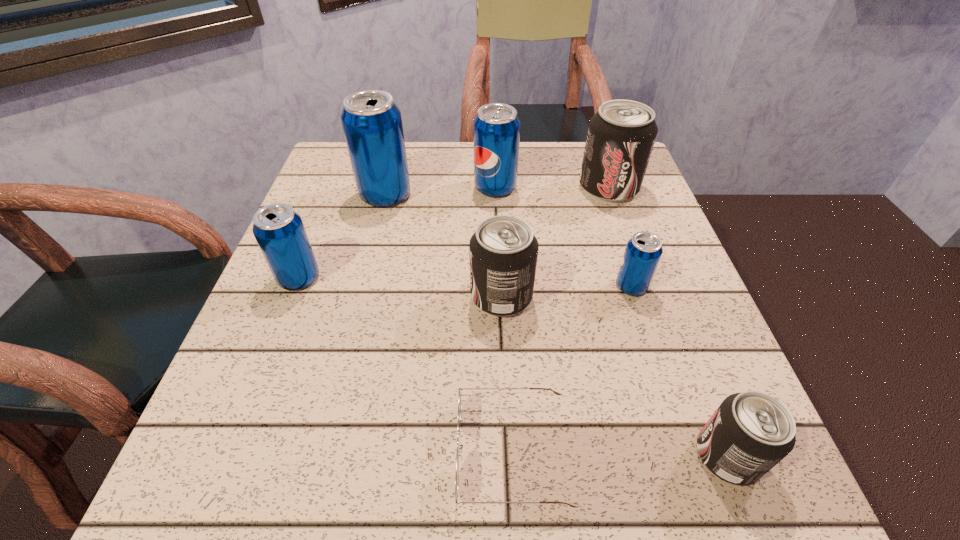
Image resolution: width=960 pixels, height=540 pixels. In the image, there is a desktop. Identify the location of vacant space at the left edge. coord(253,342).

Find the location of `free region at the right edge of the desktop`. free region at the right edge of the desktop is located at coordinates (601, 217).

The height and width of the screenshot is (540, 960). I want to click on vacant region at the far left corner of the desktop, so click(x=328, y=161).

Locate an element on the screen. The width and height of the screenshot is (960, 540). vacant space at the near left corner is located at coordinates (277, 462).

Locate an element on the screen. Image resolution: width=960 pixels, height=540 pixels. blank space at the near right corner of the desktop is located at coordinates (693, 467).

At what (x,y) coordinates should I click in order to perform the action: click on unoccupied position between the smallest blue pop soda and the second nearest black soda can. Please return your answer as a coordinate pair (x, y). This screenshot has height=540, width=960. Looking at the image, I should click on (566, 291).

Locate an element on the screen. The width and height of the screenshot is (960, 540). vacant area that lies between the smallest black soda can and the leftmost black soda can is located at coordinates (614, 376).

I want to click on vacant point located between the seventh object from right to left and the third smallest blue pop soda, so click(x=441, y=191).

The image size is (960, 540). In order to click on vacant point located between the second soda can from left to right and the leftmost soda can in this screenshot , I will do `click(342, 236)`.

The height and width of the screenshot is (540, 960). I want to click on empty location between the leftmost blue pop soda and the nearest soda can, so click(x=513, y=367).